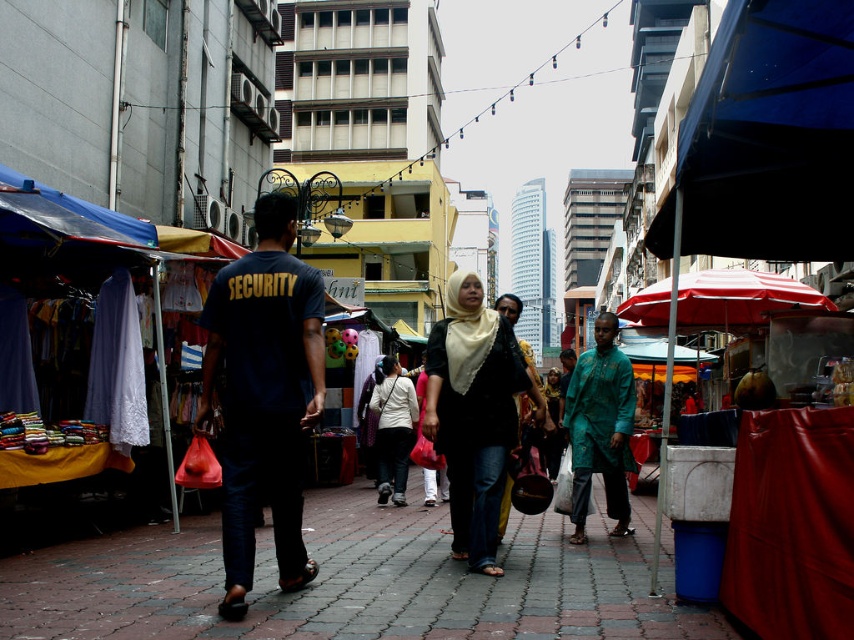
Measure the distance from matte black hijab at center to white matte shirt at center.

The distance of matte black hijab at center from white matte shirt at center is 7.59 meters.

Between point (475, 492) and point (396, 500), which one is positioned behind?

Positioned behind is point (396, 500).

Locate an element on the screen. This screenshot has height=640, width=854. matte black hijab at center is located at coordinates (474, 413).

Between brick pavement at center and dark blue cotton security shirt at center, which one is positioned lower?

brick pavement at center

Does brick pavement at center appear over dark blue cotton security shirt at center?

Incorrect, brick pavement at center is not positioned above dark blue cotton security shirt at center.

Is point (560, 625) less distant than point (273, 385)?

Yes, point (560, 625) is in front of point (273, 385).

Where is `brick pavement at center`? This screenshot has width=854, height=640. brick pavement at center is located at coordinates (354, 580).

Which of these two, dark blue cotton security shirt at center or green textured kurta at center, stands shorter?

Standing shorter between the two is dark blue cotton security shirt at center.

Can you confirm if dark blue cotton security shirt at center is positioned to the right of green textured kurta at center?

In fact, dark blue cotton security shirt at center is to the left of green textured kurta at center.

Is point (256, 429) positioned behind point (601, 426)?

No, (256, 429) is in front of (601, 426).

Where is `dark blue cotton security shirt at center`? dark blue cotton security shirt at center is located at coordinates (264, 396).